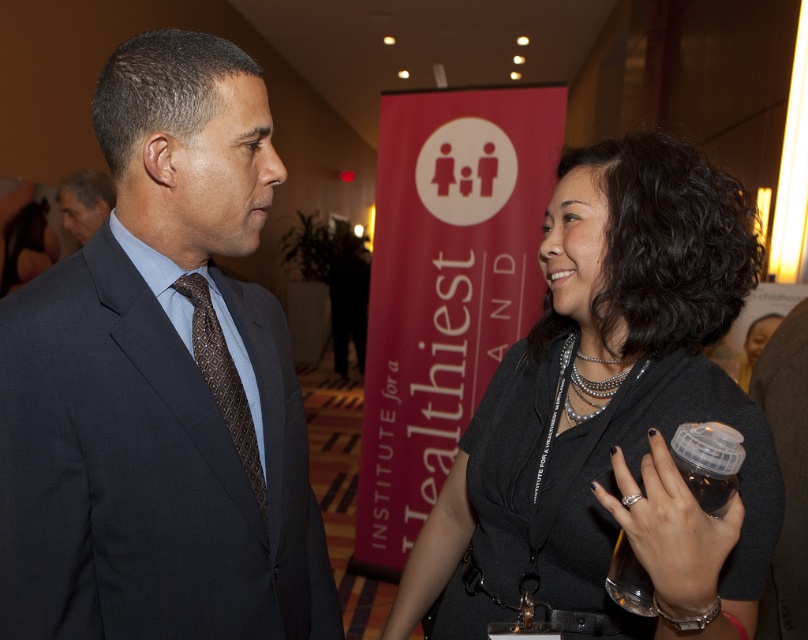
You are at a formal event and want to approach the dark gray suit at left and the matte black suit at left. Since you can only approach one at a time, which one should you approach first based on their positions?

You should approach the dark gray suit at left first because it is in front of the matte black suit at left, making it closer to you.